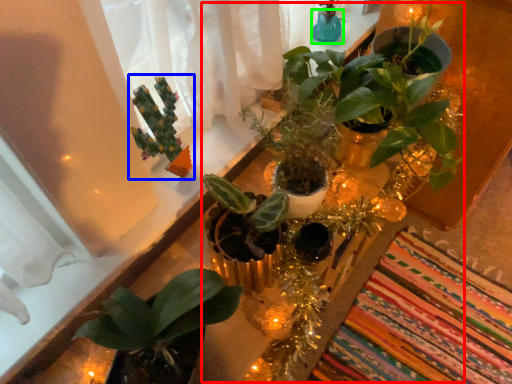
Question: Which object is the farthest from floral arrangement (highlighted by a red box)? Choose among these: houseplant (highlighted by a blue box) or glass vase (highlighted by a green box).

Choices:
 (A) houseplant
 (B) glass vase

Answer: (B)